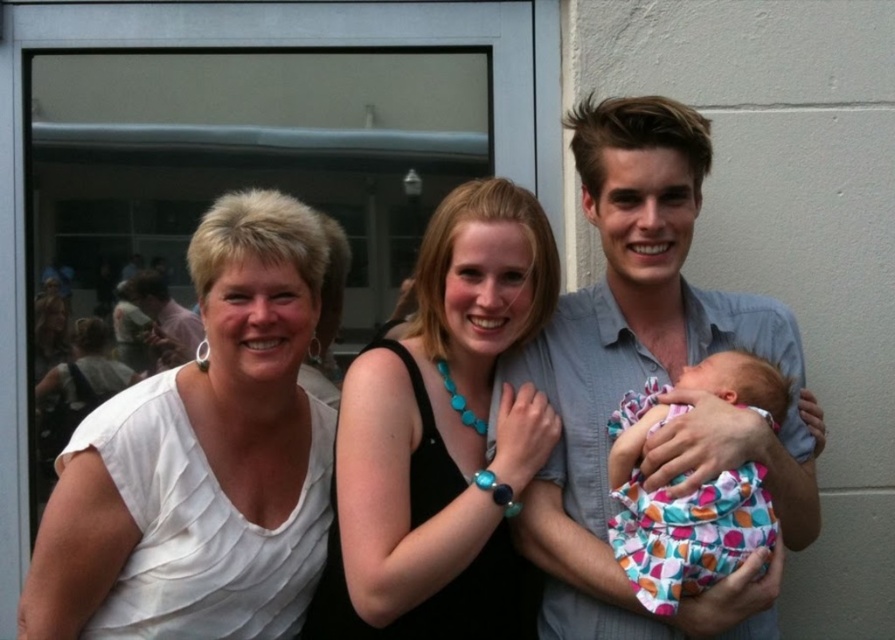
You are a photographer trying to capture a group photo of the white matte shirt at left and the black matte dress at center. Since you want to ensure both subjects are in focus, you need to know which clothing item is wider. Which one has a greater width?

The white matte shirt at left has a greater width than the black matte dress at center.

You are trying to decide which shirt to wear for a casual outdoor gathering. Based on the image, which of the two shirts, the white matte shirt at left or the gray cotton shirt at center, would be more suitable for layering under a jacket?

The gray cotton shirt at center is thicker than the white matte shirt at left, making it more suitable for layering under a jacket.

You are a photographer trying to capture a clear shot of both the gray cotton shirt at center and the black matte dress at center. Since you want to ensure both are visible in the frame, which clothing item should you focus on first to account for their size difference?

The gray cotton shirt at center is taller than the black matte dress at center, so you should focus on the gray cotton shirt at center first to ensure its full height is captured before adjusting the frame for the shorter dress.